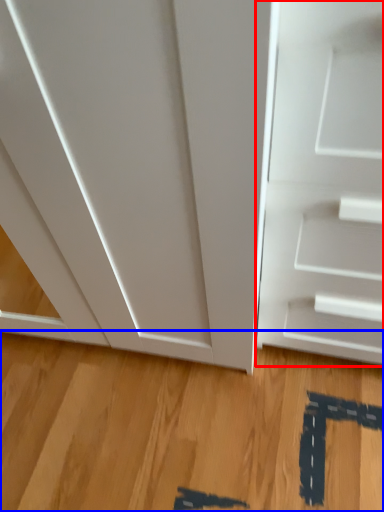
Question: Which point is further to the camera, door (highlighted by a red box) or hardwood (highlighted by a blue box)?

Choices:
 (A) door
 (B) hardwood

Answer: (B)